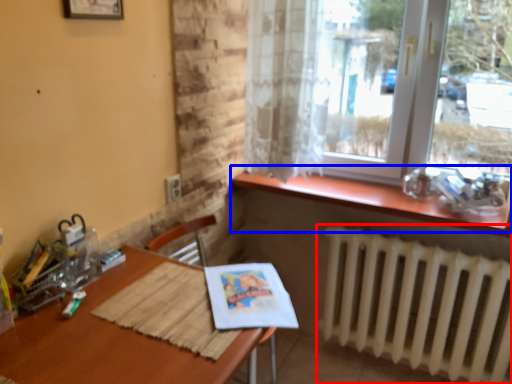
Question: Which point is closer to the camera, radiator (highlighted by a red box) or window sill (highlighted by a blue box)?

Choices:
 (A) radiator
 (B) window sill

Answer: (A)